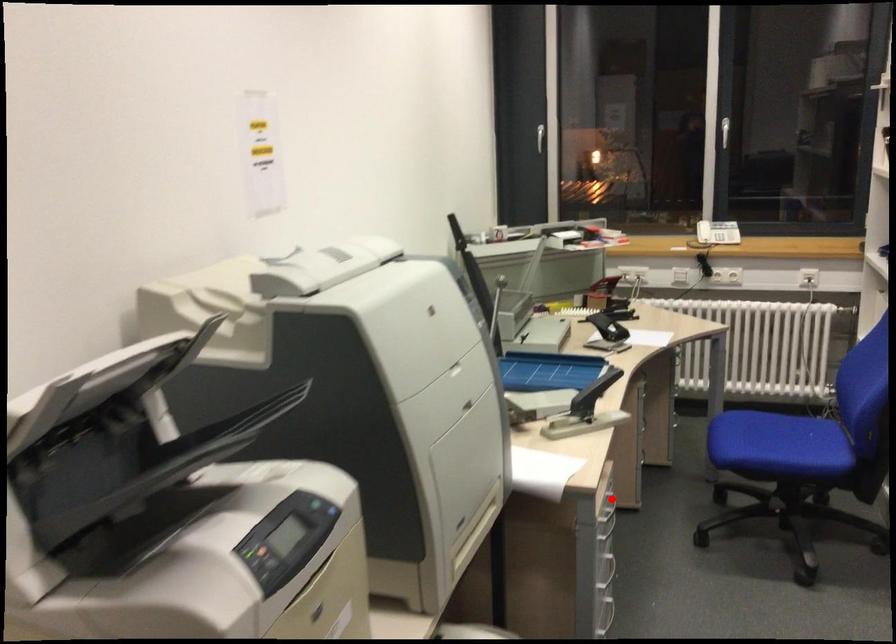
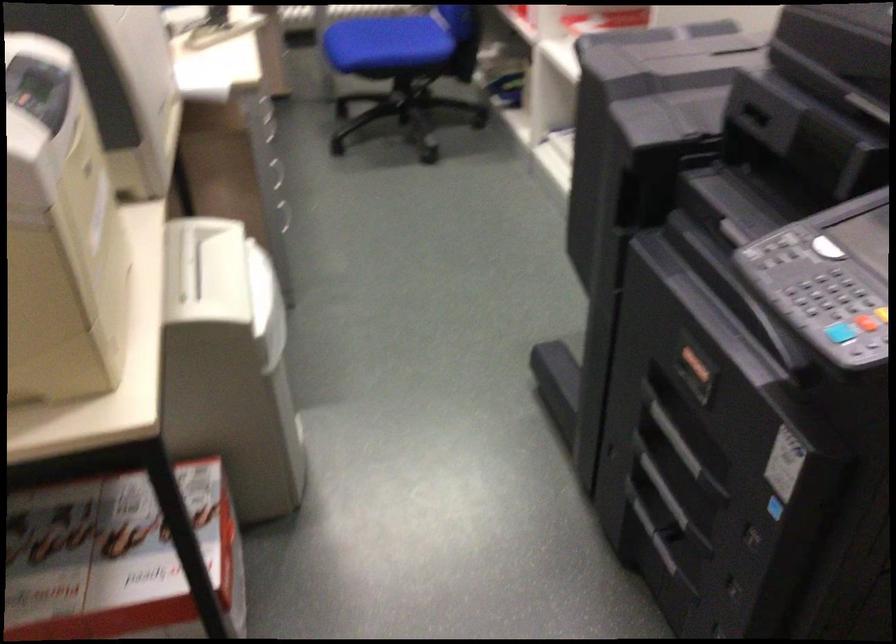
Question: I am providing you with two images of the same scene from different viewpoints. A red point is marked on the first image. At the location where the point appears in image 1, is it still visible in image 2?

Choices:
 (A) Yes
 (B) No

Answer: (B)